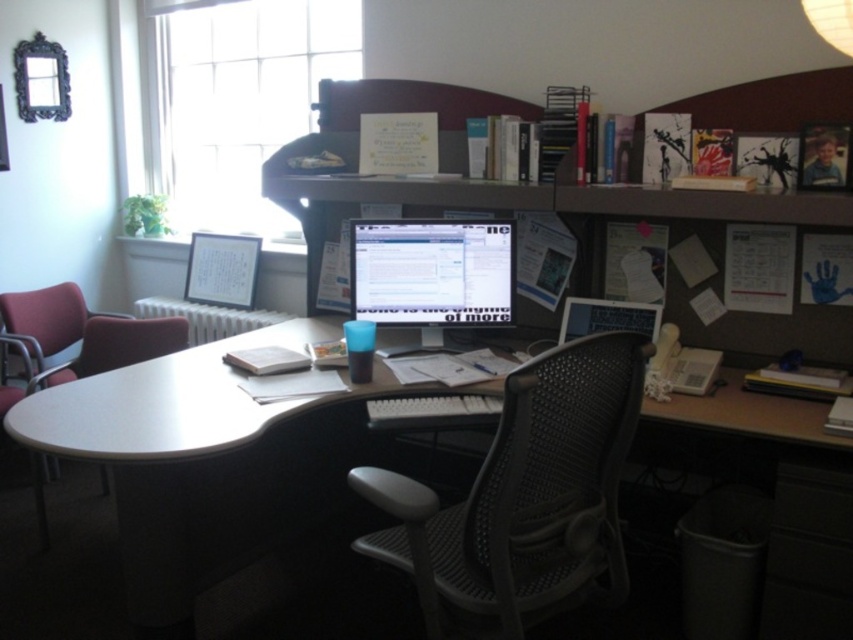
Question: From the image, what is the correct spatial relationship of matte plastic monitor at center in relation to fabric padded chair at left?

Choices:
 (A) above
 (B) below

Answer: (A)

Question: In this image, where is black mesh swivel chair at center located relative to clear glass window at upper left?

Choices:
 (A) above
 (B) below

Answer: (B)

Question: Does black mesh swivel chair at center appear on the left side of matte plastic monitor at center?

Choices:
 (A) no
 (B) yes

Answer: (A)

Question: Among these objects, which one is farthest from the camera?

Choices:
 (A) clear glass window at upper left
 (B) black mesh swivel chair at center
 (C) matte plastic monitor at center
 (D) fabric padded chair at left

Answer: (A)

Question: Which of the following is the farthest from the observer?

Choices:
 (A) matte plastic monitor at center
 (B) black mesh swivel chair at center
 (C) clear glass window at upper left
 (D) smooth white desk at center

Answer: (C)

Question: Among these points, which one is nearest to the camera?

Choices:
 (A) pos(151,156)
 (B) pos(508,269)
 (C) pos(582,538)

Answer: (C)